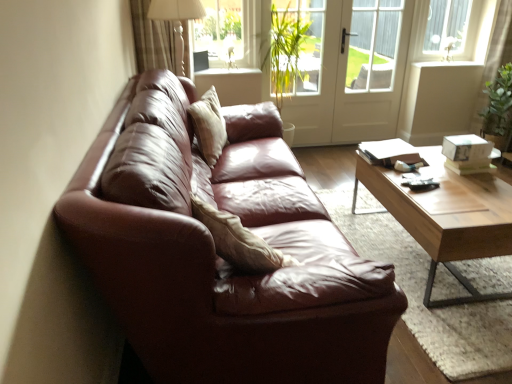
Where is `vacant area on top of transparent glass window at upper center (from a real-world perspective)`? This screenshot has width=512, height=384. vacant area on top of transparent glass window at upper center (from a real-world perspective) is located at coordinates (227, 1).